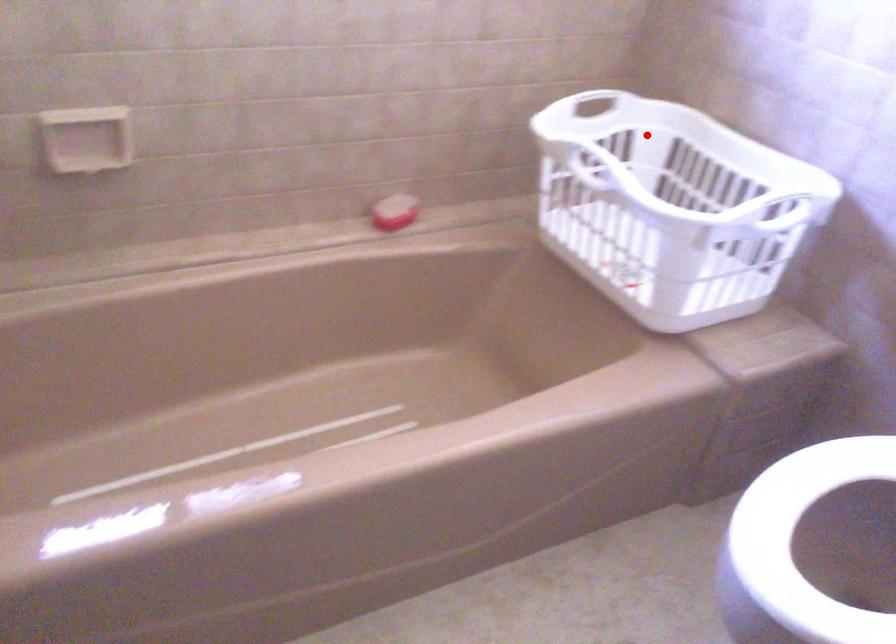
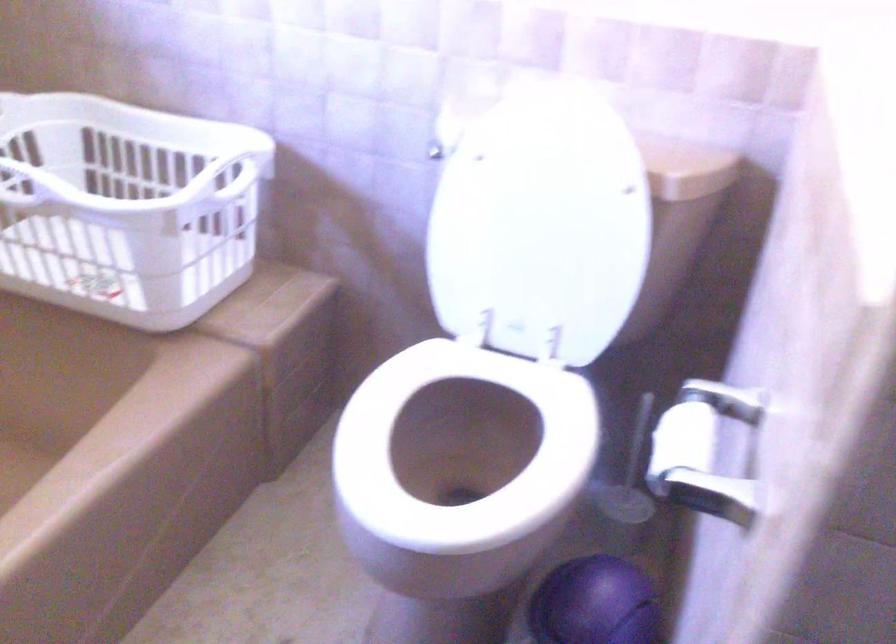
Question: I am providing you with two images of the same scene from different viewpoints. A red point is marked on the first image. Can you still see the location of the red point in image 2?

Choices:
 (A) Yes
 (B) No

Answer: (A)